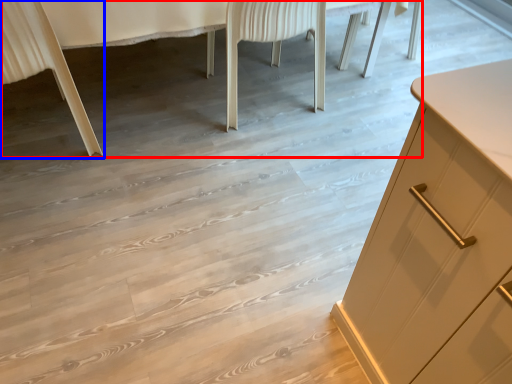
Question: Which point is closer to the camera, vanity (highlighted by a red box) or chair (highlighted by a blue box)?

Choices:
 (A) vanity
 (B) chair

Answer: (B)